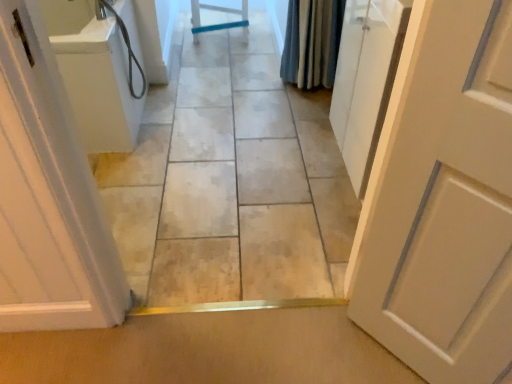
Where is `vacant space situated on the left part of blue textured fabric shower curtain at upper right`? vacant space situated on the left part of blue textured fabric shower curtain at upper right is located at coordinates (258, 93).